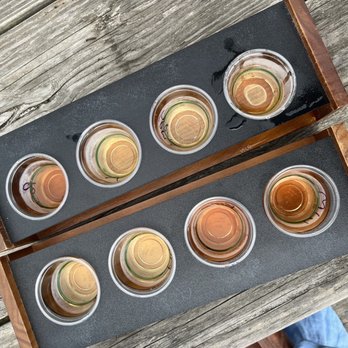
The image size is (348, 348). I want to click on wooden floor surface, so click(x=344, y=306).